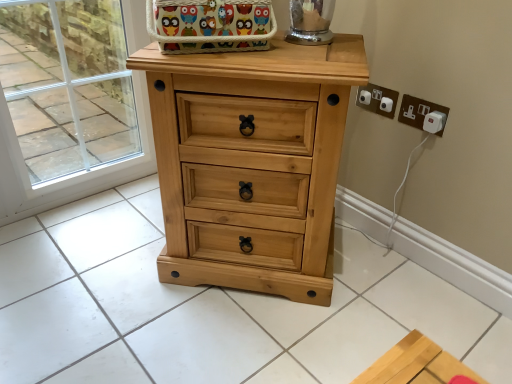
Where is `vacant space to the left of light wood chest of drawers at center`? Image resolution: width=512 pixels, height=384 pixels. vacant space to the left of light wood chest of drawers at center is located at coordinates (109, 264).